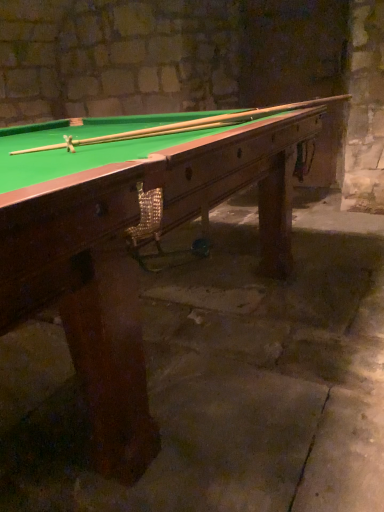
Question: Can you confirm if wooden billiard table at center is taller than wooden cue at upper center?

Choices:
 (A) no
 (B) yes

Answer: (B)

Question: Would you consider wooden billiard table at center to be distant from wooden cue at upper center?

Choices:
 (A) no
 (B) yes

Answer: (A)

Question: Could you tell me if wooden billiard table at center is facing wooden cue at upper center?

Choices:
 (A) no
 (B) yes

Answer: (A)

Question: Is wooden billiard table at center with wooden cue at upper center?

Choices:
 (A) no
 (B) yes

Answer: (A)

Question: Is wooden billiard table at center thinner than wooden cue at upper center?

Choices:
 (A) yes
 (B) no

Answer: (B)

Question: Considering the relative sizes of wooden billiard table at center and wooden cue at upper center in the image provided, is wooden billiard table at center smaller than wooden cue at upper center?

Choices:
 (A) no
 (B) yes

Answer: (A)

Question: Is wooden cue at upper center smaller than wooden billiard table at center?

Choices:
 (A) no
 (B) yes

Answer: (B)

Question: Is wooden cue at upper center taller than wooden billiard table at center?

Choices:
 (A) no
 (B) yes

Answer: (A)

Question: Does wooden cue at upper center appear on the left side of wooden billiard table at center?

Choices:
 (A) yes
 (B) no

Answer: (B)

Question: Is wooden cue at upper center outside wooden billiard table at center?

Choices:
 (A) yes
 (B) no

Answer: (B)

Question: Is wooden billiard table at center completely or partially inside wooden cue at upper center?

Choices:
 (A) yes
 (B) no

Answer: (B)

Question: Is wooden cue at upper center positioned far away from wooden billiard table at center?

Choices:
 (A) no
 (B) yes

Answer: (A)

Question: From a real-world perspective, is wooden billiard table at center above or below wooden cue at upper center?

Choices:
 (A) below
 (B) above

Answer: (A)